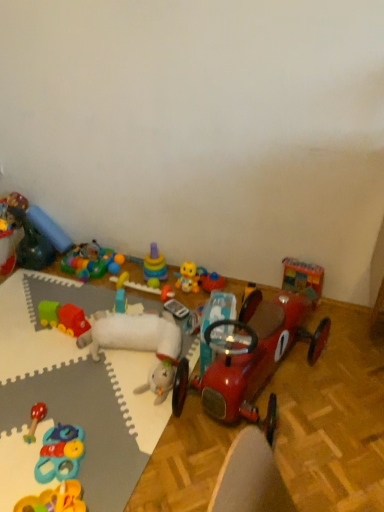
This screenshot has height=512, width=384. What are the coordinates of `free space between rubber green and red train at lower left, positioned as the ninth toy in right-to-left order, and wooden rattle at lower left, the seventh toy viewed from the right` in the screenshot? It's located at (52, 368).